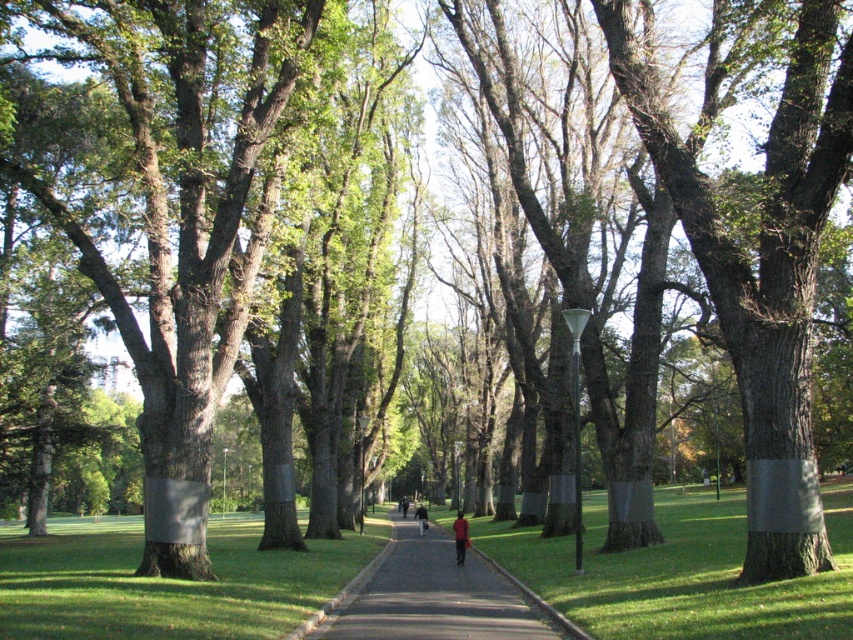
Looking at this image, which of these two, smooth gray bark at center or black asphalt path at center, stands taller?

Standing taller between the two is black asphalt path at center.

Is point (811, 476) farther from viewer compared to point (431, 540)?

No, (811, 476) is in front of (431, 540).

Is point (642, 61) positioned in front of point (432, 524)?

Yes, point (642, 61) is closer to viewer.

Where is `smooth gray bark at center`? This screenshot has width=853, height=640. smooth gray bark at center is located at coordinates (762, 272).

Between black asphalt path at center and dark brown leather jacket at center, which one has less height?

Standing shorter between the two is dark brown leather jacket at center.

Between point (450, 605) and point (416, 516), which one is positioned in front?

Point (450, 605)

Locate an element on the screen. The image size is (853, 640). black asphalt path at center is located at coordinates (432, 595).

Describe the element at coordinates (762, 272) in the screenshot. I see `smooth gray bark at center` at that location.

Does smooth gray bark at center appear over red shirt at center?

Yes.

You are a GUI agent. You are given a task and a screenshot of the screen. Output one action in this format:
    pyautogui.click(x=<x>, y=<y>)
    Task: Click on the smooth gray bark at center
    Image resolution: width=853 pixels, height=640 pixels.
    Given the screenshot: What is the action you would take?
    pyautogui.click(x=762, y=272)

Identify the location of smooth gray bark at center. pos(762,272).